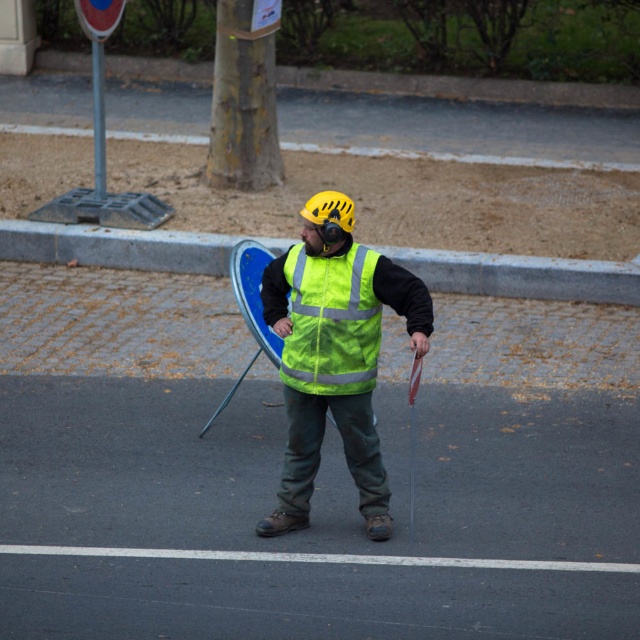
Which is in front, point (358, 388) or point (323, 204)?

Point (323, 204)

Identify the location of high-visibility fabric safety vest at center. The width and height of the screenshot is (640, 640). (332, 323).

Does high visibility fabric vest at center have a greater width compared to metallic silver ski pole at center?

Yes.

Find the location of a particular element. This screenshot has width=640, height=640. high visibility fabric vest at center is located at coordinates (333, 355).

Is point (276, 288) more distant than point (412, 541)?

Yes, point (276, 288) is farther from viewer.

At what (x,y) coordinates should I click in order to perform the action: click on high visibility fabric vest at center. Please return your answer as a coordinate pair (x, y). The width and height of the screenshot is (640, 640). Looking at the image, I should click on (333, 355).

Is high visibility fabric vest at center thinner than high-visibility fabric safety vest at center?

No.

Does point (317, 394) come behind point (310, 337)?

Yes.

Does point (368, 529) lie behind point (330, 344)?

Yes, it is behind point (330, 344).

Where is `high visibility fabric vest at center`? high visibility fabric vest at center is located at coordinates tap(333, 355).